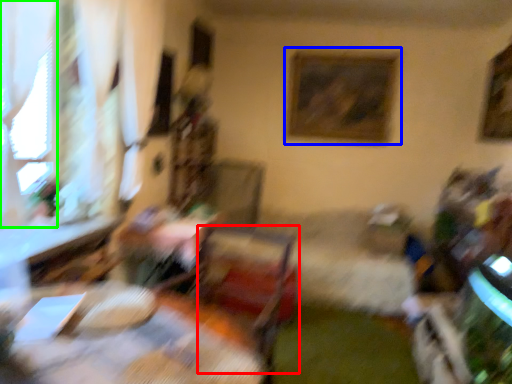
Question: Considering the real-world distances, which object is closest to swivel chair (highlighted by a red box)? picture frame (highlighted by a blue box) or window (highlighted by a green box).

Choices:
 (A) picture frame
 (B) window

Answer: (B)